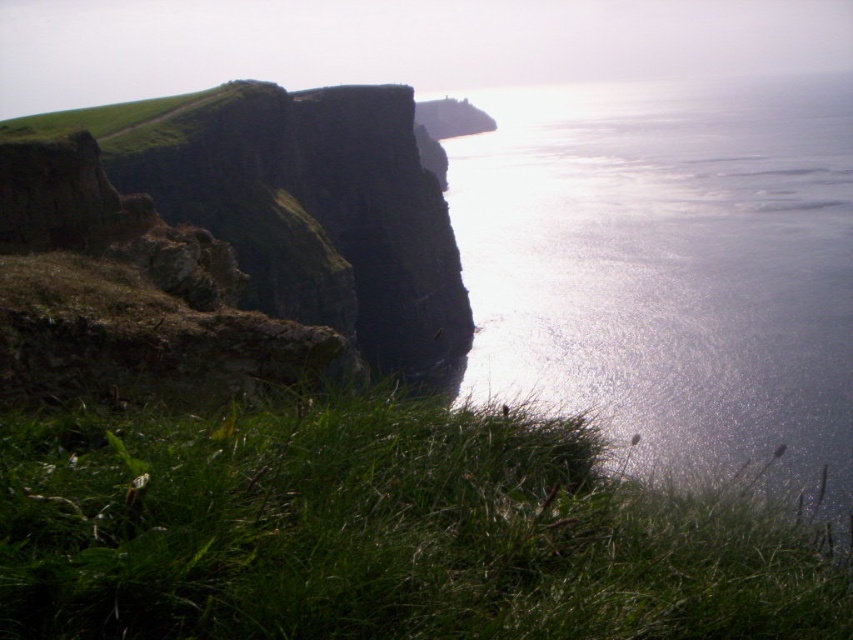
You are standing at the center of the image and want to walk towards the green grassy at lower left. Which direction should you face to move directly towards it?

To move directly towards the green grassy at lower left from the center of the image, you should face the lower left direction since that is where the green grassy at lower left is located.

You are standing at the base of the cliffs and want to walk towards the ocean. You notice two points marked in the image. Which point, point (827,150) or point (328,228), is closer to your current position?

Point (827,150) is further to the viewer than point (328,228), so the closer point to your current position is point (328,228).